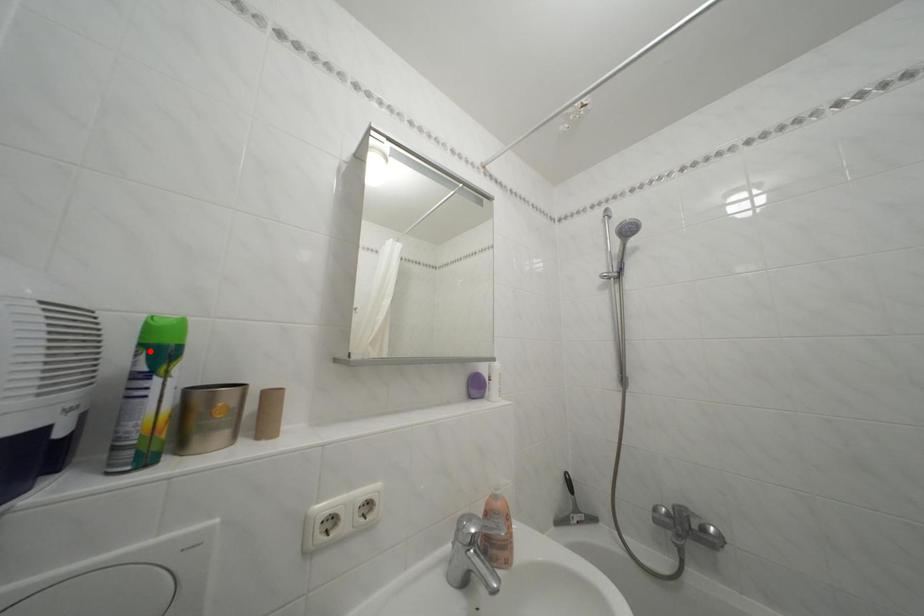
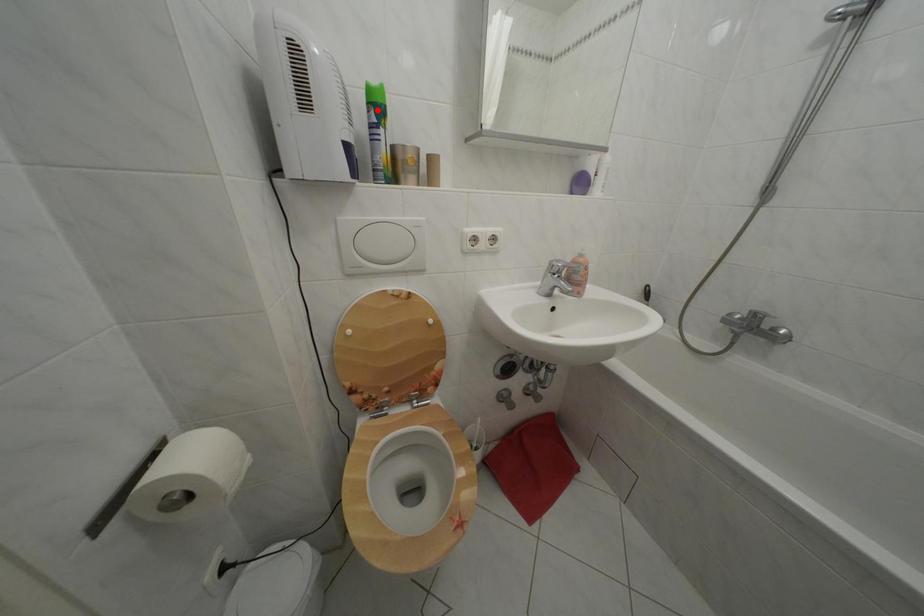
I am providing you with two images of the same scene from different viewpoints. A red point is marked on the first image and another point is marked on the second image. Is the marked point in image1 the same physical position as the marked point in image2?

Yes